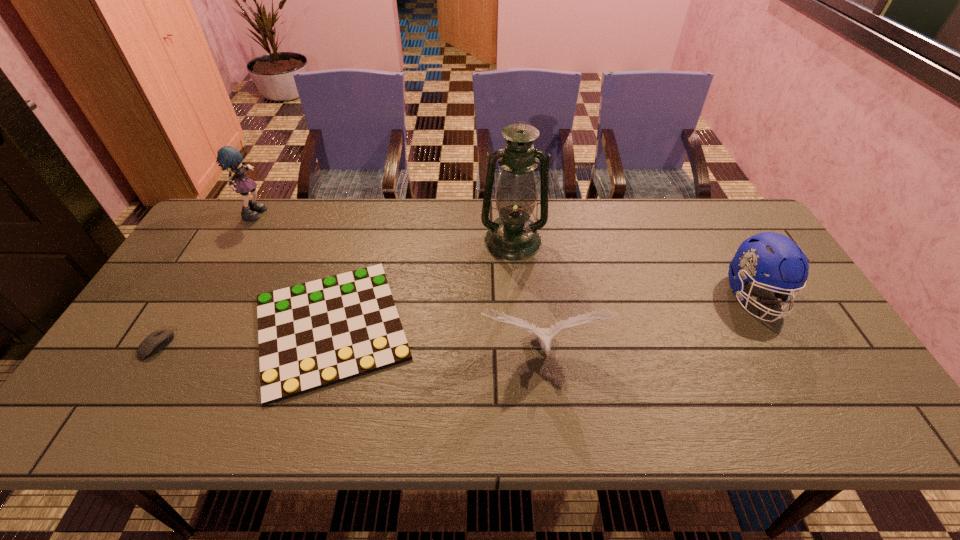
Where is `object positioned at the right edge`? object positioned at the right edge is located at coordinates (771, 253).

Locate an element on the screen. object that is at the far left corner is located at coordinates (228, 157).

You are a GUI agent. You are given a task and a screenshot of the screen. Output one action in this format:
    pyautogui.click(x=<x>, y=<y>)
    Task: Click on the free space at the far edge
    This screenshot has height=540, width=960.
    Given the screenshot: What is the action you would take?
    click(x=396, y=213)

This screenshot has width=960, height=540. I want to click on vacant space at the near edge of the desktop, so click(x=796, y=428).

The image size is (960, 540). In the image, there is a desktop. What are the coordinates of `vacant space at the left edge` in the screenshot? It's located at (173, 305).

At what (x,y) coordinates should I click in order to perform the action: click on free region at the far left corner of the desktop. Please return your answer as a coordinate pair (x, y). This screenshot has height=540, width=960. Looking at the image, I should click on (218, 235).

Locate an element on the screen. This screenshot has width=960, height=540. free space between the oil lamp and the gull is located at coordinates (528, 296).

Find the location of a particular element. The width and height of the screenshot is (960, 540). vacant area that lies between the second shortest object and the second tallest object is located at coordinates (206, 278).

Locate an element on the screen. This screenshot has width=960, height=540. vacant region between the farthest object and the shortest object is located at coordinates (294, 269).

Identify the location of empty space that is in between the shortest object and the fifth shortest object. (294, 269).